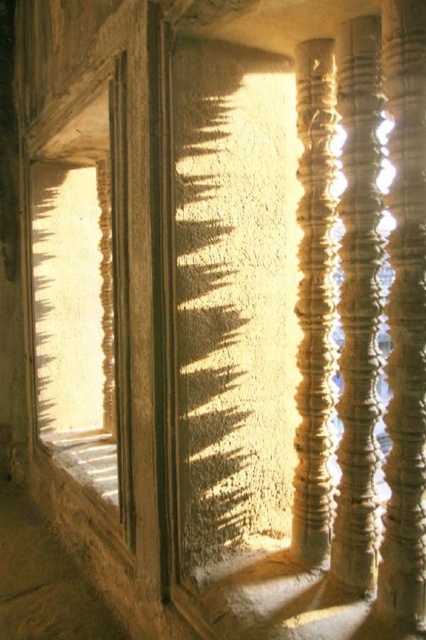
Question: Based on their relative distances, which object is farther from the matte stone window at left?

Choices:
 (A) smooth gold column at center
 (B) white stone window sill at lower left
 (C) smooth stone pillar at center
 (D) smooth stone pillar at right

Answer: (D)

Question: Is smooth stone pillar at right thinner than white stone window sill at lower left?

Choices:
 (A) yes
 (B) no

Answer: (A)

Question: Does smooth stone pillar at right appear on the left side of smooth gold column at center?

Choices:
 (A) no
 (B) yes

Answer: (A)

Question: Is smooth stone pillar at right positioned behind smooth stone pillar at center?

Choices:
 (A) yes
 (B) no

Answer: (B)

Question: Which of the following is the farthest from the observer?

Choices:
 (A) click(x=109, y=472)
 (B) click(x=46, y=436)
 (C) click(x=319, y=432)

Answer: (B)

Question: Which of the following is the closest to the observer?

Choices:
 (A) matte stone window at left
 (B) smooth stone pillar at center
 (C) white stone window sill at lower left

Answer: (B)